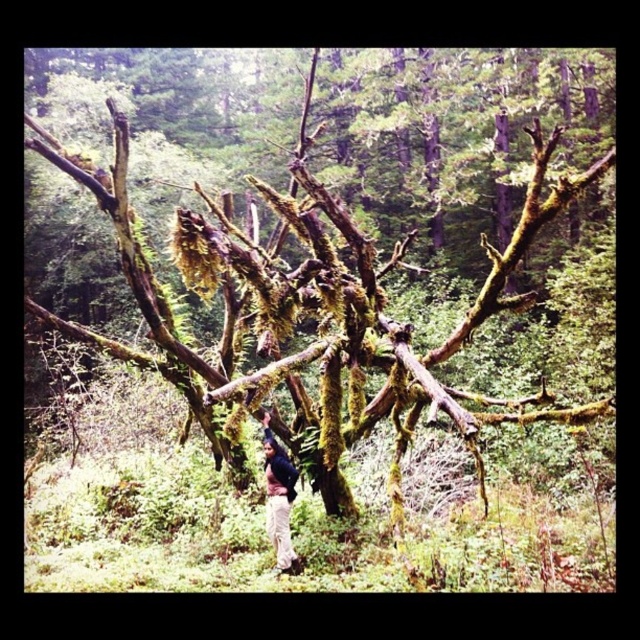
You are a hiker who wants to take a selfie with the green mossy tree at center and the light beige pants at lower center. Your camera has a maximum focus range of 60 centimeters. Can you capture both objects in focus without moving either the camera or the objects?

The distance between the green mossy tree at center and the light beige pants at lower center is 65.38 centimeters. Since your camera can only focus within 60 centimeters, you cannot capture both in focus without adjusting their positions.

Based on the photo, you are a photographer planning to capture the green mossy tree at center and the light beige pants at lower center in a single frame. Based on their sizes, which object should you focus on first to ensure both are in focus?

The green mossy tree at center is smaller than the light beige pants at lower center. To ensure both are in focus, you should focus on the light beige pants at lower center first since it is closer to the camera, allowing the tree in the background to be within the depth of field.

You are a hiker trying to navigate through the forest and come across the green mossy tree at center. Based on its position, can you determine if it is blocking your path directly ahead?

The green mossy tree at center is located at point [312,310], which is directly in front of you, so it is blocking your path directly ahead.